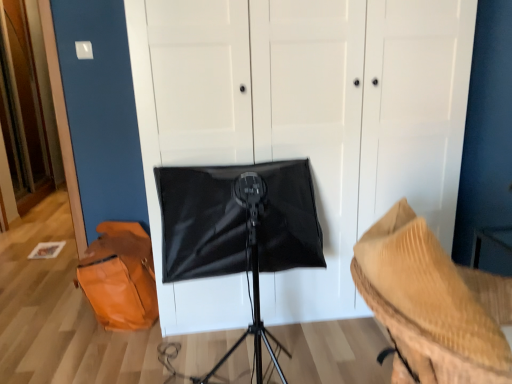
In order to click on vacant space in front of orange leather messenger bag at lower left in this screenshot , I will do coord(75,357).